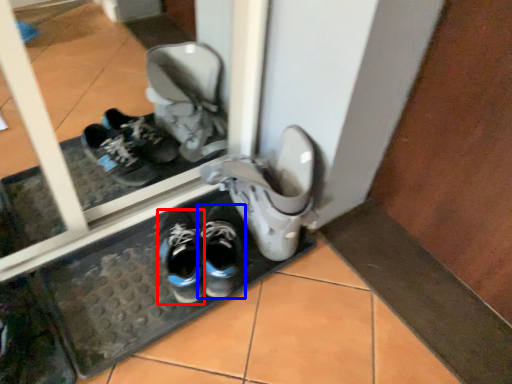
Question: Which point is closer to the camera, running shoe (highlighted by a red box) or footwear (highlighted by a blue box)?

Choices:
 (A) running shoe
 (B) footwear

Answer: (A)